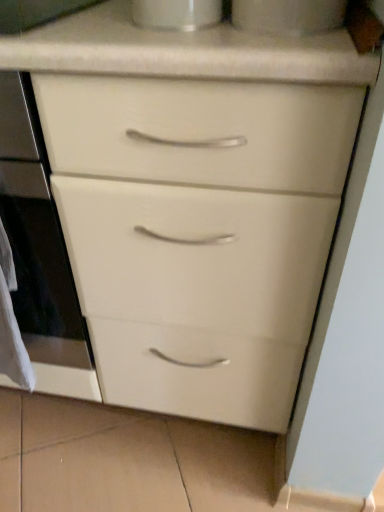
Question: Is white paper at left positioned far away from white glossy cup at upper center, which appears as the 1th appliance when viewed from the left?

Choices:
 (A) yes
 (B) no

Answer: (B)

Question: Can you confirm if white paper at left is shorter than white glossy cup at upper center, marked as the second appliance in a right-to-left arrangement?

Choices:
 (A) yes
 (B) no

Answer: (B)

Question: Is white paper at left oriented away from white glossy cup at upper center, marked as the second appliance in a right-to-left arrangement?

Choices:
 (A) no
 (B) yes

Answer: (A)

Question: Is the depth of white paper at left less than that of white glossy cup at upper center, marked as the second appliance in a right-to-left arrangement?

Choices:
 (A) no
 (B) yes

Answer: (A)

Question: Can you confirm if white paper at left is wider than white glossy cup at upper center, marked as the second appliance in a right-to-left arrangement?

Choices:
 (A) yes
 (B) no

Answer: (B)

Question: Looking at their shapes, would you say white glossy cup at upper center, which appears as the 1th appliance when viewed from the left, is wider or thinner than white glossy cup at upper center, arranged as the 1th appliance when viewed from the right?

Choices:
 (A) thin
 (B) wide

Answer: (A)

Question: Is white glossy cup at upper center, which appears as the 1th appliance when viewed from the left, bigger or smaller than white glossy cup at upper center, arranged as the 1th appliance when viewed from the right?

Choices:
 (A) big
 (B) small

Answer: (B)

Question: From their relative heights in the image, would you say white glossy cup at upper center, which appears as the 1th appliance when viewed from the left, is taller or shorter than white glossy cup at upper center, the second appliance viewed from the left?

Choices:
 (A) short
 (B) tall

Answer: (A)

Question: From the image's perspective, is white glossy cup at upper center, marked as the second appliance in a right-to-left arrangement, located above or below white glossy cup at upper center, arranged as the 1th appliance when viewed from the right?

Choices:
 (A) above
 (B) below

Answer: (B)

Question: From a real-world perspective, is white glossy oven at center physically located above or below white paper at left?

Choices:
 (A) above
 (B) below

Answer: (A)

Question: Considering the positions of point (84, 393) and point (18, 360), is point (84, 393) closer or farther from the camera than point (18, 360)?

Choices:
 (A) closer
 (B) farther

Answer: (B)

Question: Is white glossy oven at center in front of or behind white paper at left in the image?

Choices:
 (A) behind
 (B) front

Answer: (B)

Question: Is white glossy oven at center bigger or smaller than white paper at left?

Choices:
 (A) small
 (B) big

Answer: (B)

Question: From a real-world perspective, is white paper at left positioned above or below white glossy cup at upper center, the second appliance viewed from the left?

Choices:
 (A) above
 (B) below

Answer: (B)

Question: From the image's perspective, relative to white glossy cup at upper center, arranged as the 1th appliance when viewed from the right, is white paper at left above or below?

Choices:
 (A) below
 (B) above

Answer: (A)